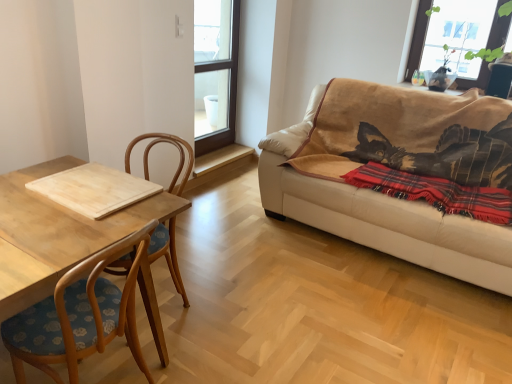
Locate an element on the screen. The width and height of the screenshot is (512, 384). free space to the left of beige leather couch at right is located at coordinates (243, 242).